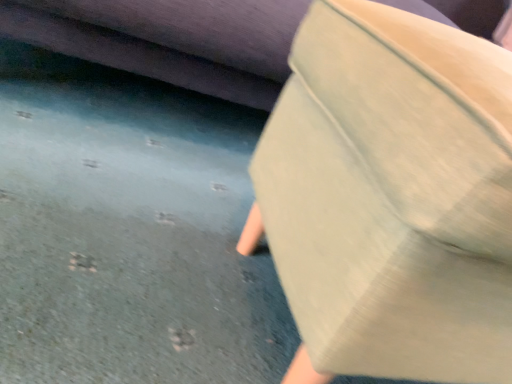
The width and height of the screenshot is (512, 384). Describe the element at coordinates (393, 195) in the screenshot. I see `satin green ottoman at center` at that location.

In order to click on satin green ottoman at center in this screenshot , I will do `click(393, 195)`.

In the scene shown: What is the approximate height of satin green ottoman at center?

The height of satin green ottoman at center is 16.73 inches.

This screenshot has height=384, width=512. Find the location of `satin green ottoman at center`. satin green ottoman at center is located at coordinates (393, 195).